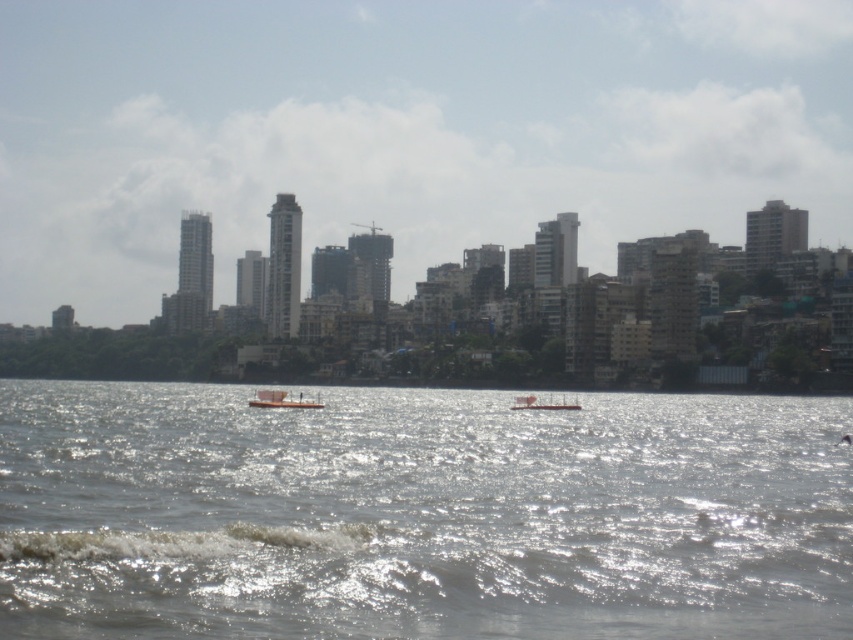
You are a photographer standing at the edge of the waterfront. You want to capture a photo where the shiny silver water at center is clearly visible above the white plastic boat at center. Is this possible based on their positions?

Yes, the shiny silver water at center is positioned above the white plastic boat at center, so capturing this arrangement in the photo is feasible.

What is the exact location of the shiny silver water at center in the image?

The shiny silver water at center is located at point (x=421, y=515).

You are a photographer trying to capture the orange matte boat at center in your shot. Since you want to emphasize the boat, should you position yourself closer to the shiny silver water at center or farther away?

To emphasize the orange matte boat at center, you should position yourself farther away from the shiny silver water at center. Since the shiny silver water at center is larger in size than the orange matte boat at center, moving farther away will reduce the prominence of the water and allow the boat to stand out more in the composition.